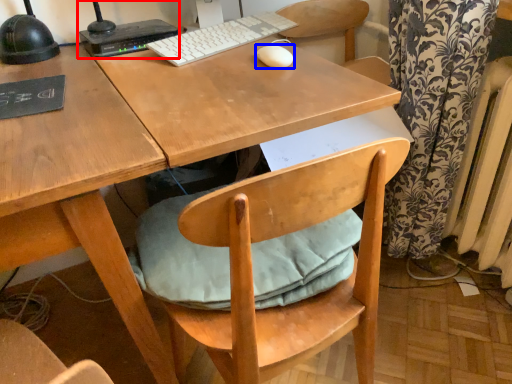
Question: Among these objects, which one is nearest to the camera, desktop computer (highlighted by a red box) or mouse (highlighted by a blue box)?

Choices:
 (A) desktop computer
 (B) mouse

Answer: (B)